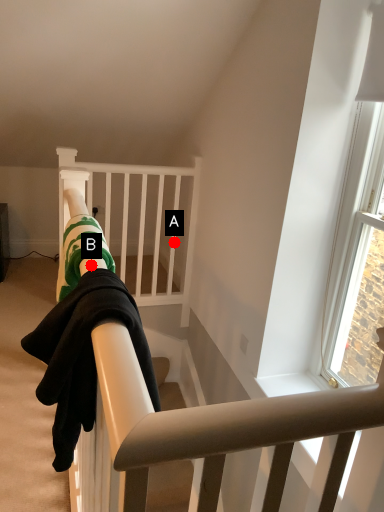
Question: Two points are circled on the image, labeled by A and B beside each circle. Which point appears farthest from the camera in this image?

Choices:
 (A) A is further
 (B) B is further

Answer: (A)